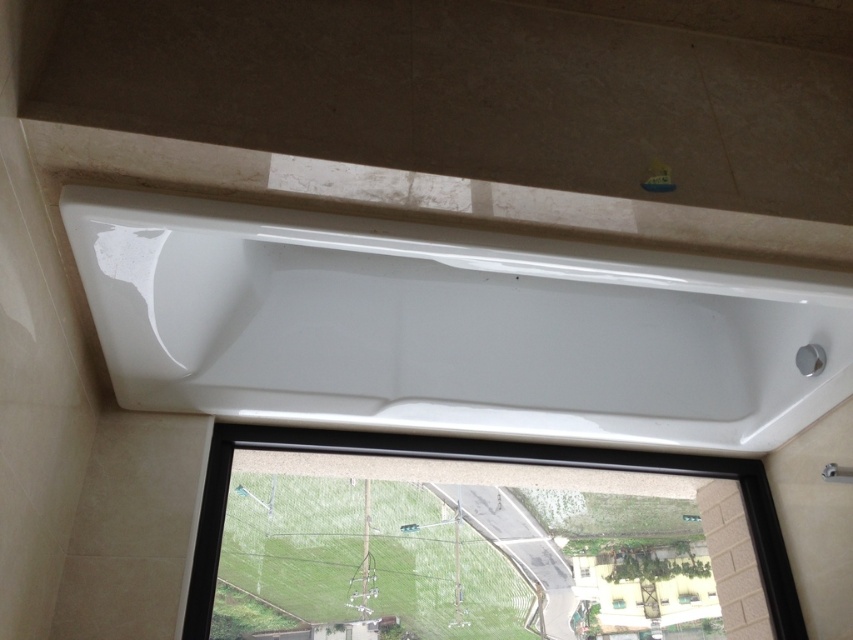
You are a painter who wants to paint the white glossy bathtub at center and the transparent glass window at lower center. Which object requires you to stand further back to paint its entire surface?

The white glossy bathtub at center requires you to stand further back to paint its entire surface because it is much taller than the transparent glass window at lower center.

You are designing a bathroom layout and need to ensure that the white glossy bathtub at center does not block the view through the transparent glass window at center. Based on their heights, can the bathtub be placed in such a way that it doesn not obstruct the window?

The white glossy bathtub at center is taller than the transparent glass window at center, so placing it directly in front of the window would block the view. To avoid obstruction, the bathtub should be positioned to the side or adjusted so that its height does not cover the window.

You are a painter who needs to paint the white glossy bathtub at center. You have a 1.5 meter long brush. If you stand at the camera position, can you reach the bathtub with the brush?

The white glossy bathtub at center and camera are 1.02 meters apart from each other. Since the brush is 1.5 meters long, which is longer than the distance between you and the bathtub, you can reach it.